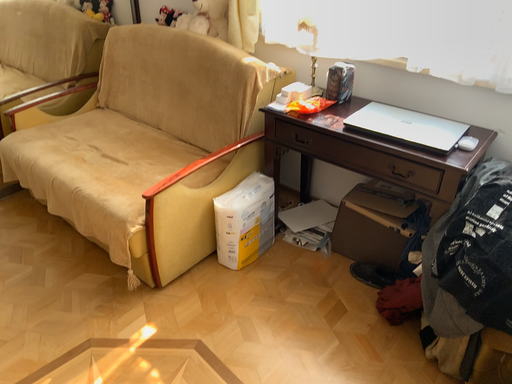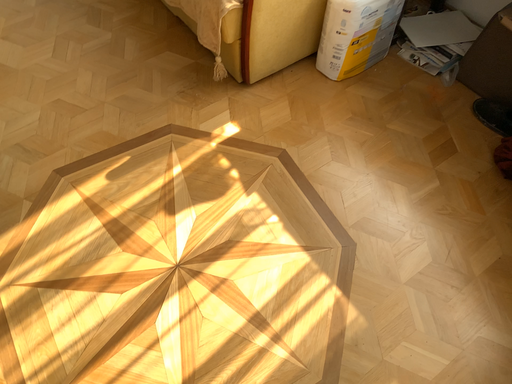
Question: Which way did the camera rotate in the video?

Choices:
 (A) rotated upward
 (B) rotated downward

Answer: (B)